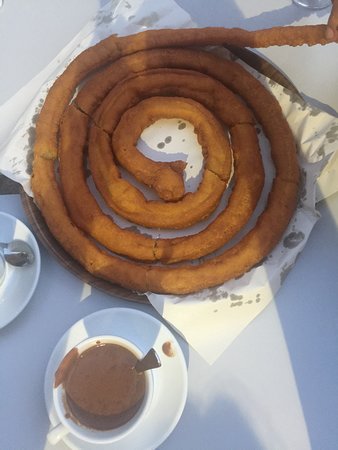
Locate an element on the screen. handle is located at coordinates (61, 432).